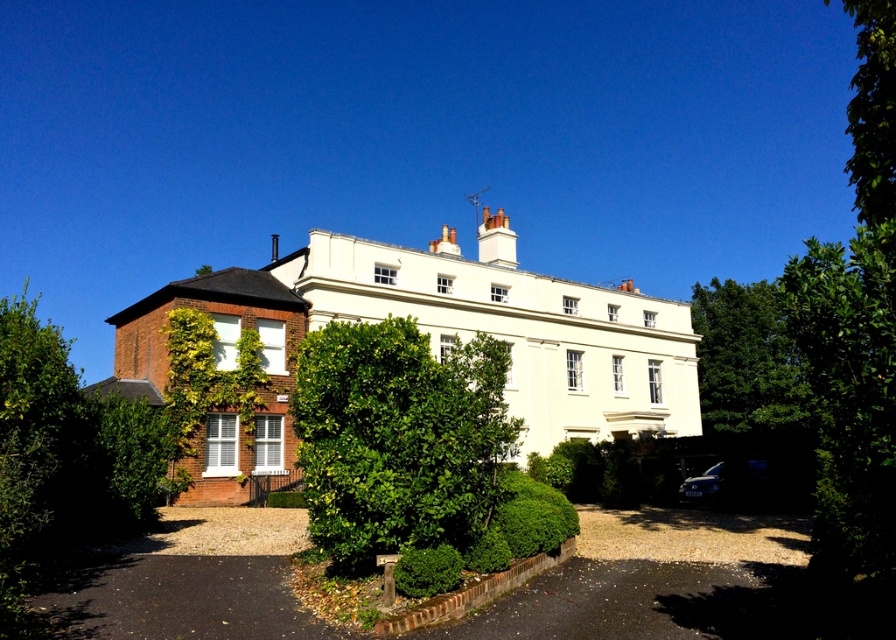
This screenshot has height=640, width=896. What do you see at coordinates (397, 436) in the screenshot?
I see `green leafy bush at center` at bounding box center [397, 436].

How distant is green leafy bush at center from green leafy tree at right?

A distance of 67.29 meters exists between green leafy bush at center and green leafy tree at right.

In order to click on green leafy bush at center in this screenshot , I will do `click(397, 436)`.

Image resolution: width=896 pixels, height=640 pixels. I want to click on green leafy bush at center, so click(x=397, y=436).